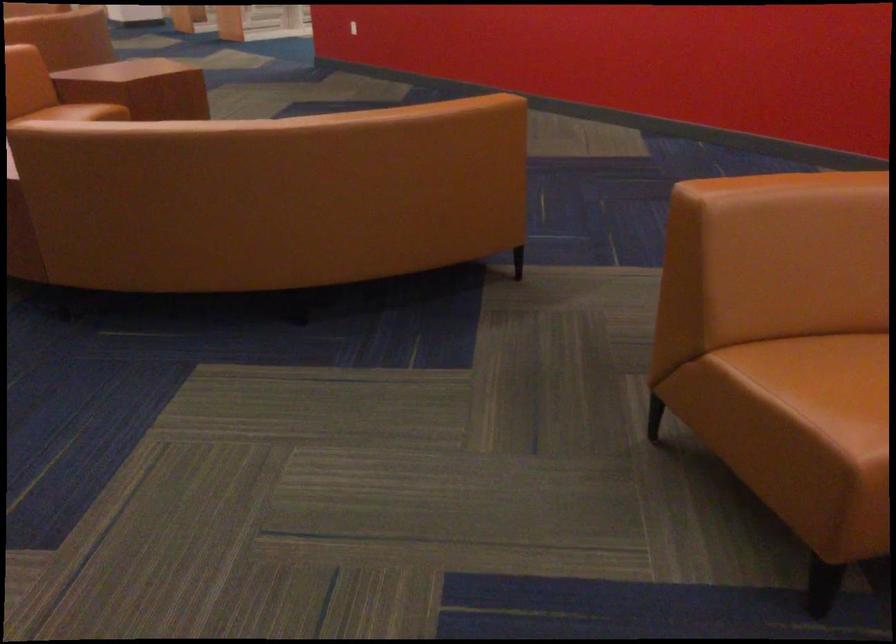
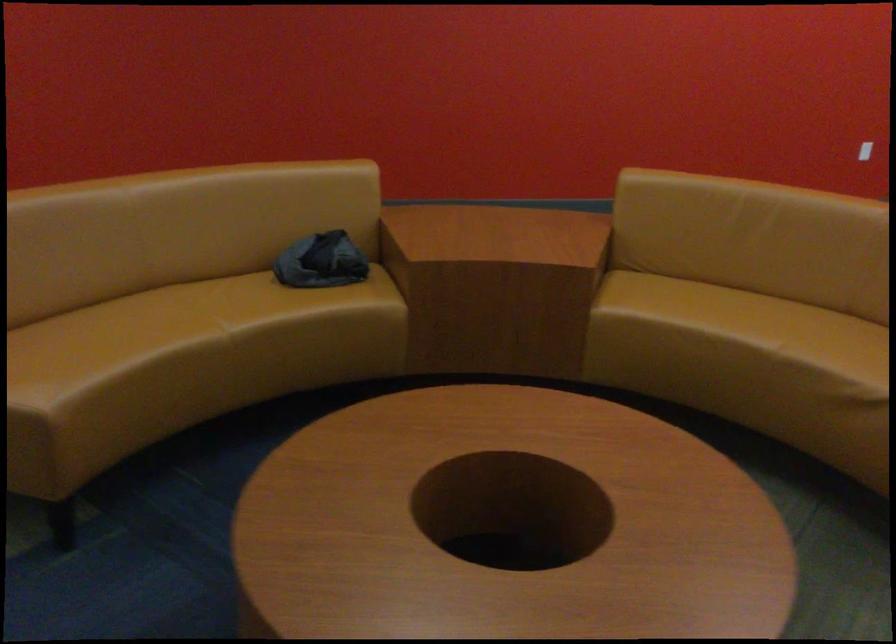
Question: Based on the continuous images, in which direction is the camera rotating? Reply with the corresponding letter.

Choices:
 (A) Left
 (B) Right
 (C) Up
 (D) Down

Answer: (B)